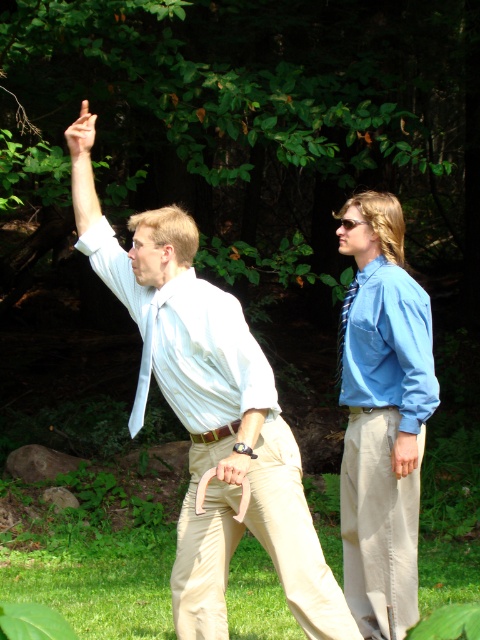
Is white silk tie at center below shiny blue tie at right?

Yes.

Can you confirm if white silk tie at center is taller than shiny blue tie at right?

Incorrect, white silk tie at center's height is not larger of shiny blue tie at right's.

Is point (149, 353) in front of point (338, 360)?

Yes, it is in front of point (338, 360).

Where is `white silk tie at center`? white silk tie at center is located at coordinates (144, 371).

Does green leafy tree at upper center appear under khaki pants at right?

No, green leafy tree at upper center is not below khaki pants at right.

Is green leafy tree at upper center above khaki pants at right?

Correct, green leafy tree at upper center is located above khaki pants at right.

Who is more distant from viewer, [179,148] or [392,307]?

Point [179,148]

I want to click on green leafy tree at upper center, so click(254, 115).

Does light blue shirt at center have a smaller size compared to shiny blue tie at right?

Yes, light blue shirt at center is smaller than shiny blue tie at right.

Is light blue shirt at center bigger than shiny blue tie at right?

No, light blue shirt at center is not bigger than shiny blue tie at right.

Does point (284, 465) lie behind point (340, 323)?

No, it is in front of (340, 323).

This screenshot has height=640, width=480. What are the coordinates of `light blue shirt at center` in the screenshot? It's located at (212, 416).